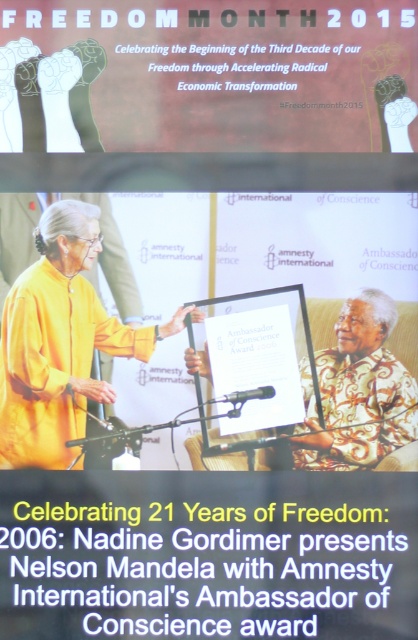
Question: Which point is farther from the camera taking this photo?

Choices:
 (A) (213, 401)
 (B) (341, 403)

Answer: (A)

Question: Does white floral shirt at center have a smaller size compared to black metallic microphone at center?

Choices:
 (A) yes
 (B) no

Answer: (B)

Question: Does white floral shirt at center come in front of black metallic microphone at center?

Choices:
 (A) yes
 (B) no

Answer: (A)

Question: Does white floral shirt at center appear on the right side of black metallic microphone at center?

Choices:
 (A) no
 (B) yes

Answer: (B)

Question: Which point is closer to the camera?

Choices:
 (A) black metallic microphone at center
 (B) white floral shirt at center

Answer: (B)

Question: Which of the following is the farthest from the observer?

Choices:
 (A) (56, 330)
 (B) (234, 396)
 (C) (298, 468)

Answer: (A)